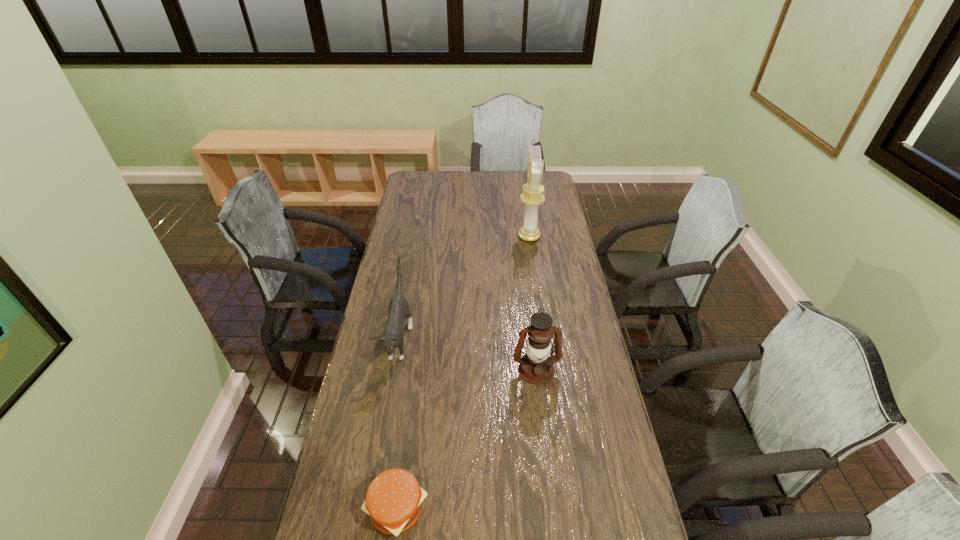
This screenshot has width=960, height=540. I want to click on the farthest object, so click(x=532, y=196).

Find the location of `award`. award is located at coordinates (532, 196).

The width and height of the screenshot is (960, 540). Identify the location of lantern. (536, 367).

At what (x,y) coordinates should I click in order to perform the action: click on cat. Please return your answer as a coordinate pair (x, y). The width and height of the screenshot is (960, 540). Looking at the image, I should click on (392, 338).

The height and width of the screenshot is (540, 960). What are the coordinates of `free spot located 0.110m on the front-facing side of the award` in the screenshot? It's located at (493, 237).

Where is `free space located 0.140m on the front-facing side of the award`? free space located 0.140m on the front-facing side of the award is located at coordinates (487, 237).

Locate an element on the screen. This screenshot has height=540, width=960. vacant position located on the front-facing side of the award is located at coordinates (446, 237).

You are a GUI agent. You are given a task and a screenshot of the screen. Output one action in this format:
    pyautogui.click(x=<x>, y=<y>)
    Task: Click on the vacant space located on the side of the second tallest object, there is a wick adjustment knob
    Image resolution: width=960 pixels, height=540 pixels.
    Given the screenshot: What is the action you would take?
    pyautogui.click(x=546, y=453)

This screenshot has width=960, height=540. Identify the location of free point located 0.180m at the face of the cat. (383, 431).

At what (x,y) coordinates should I click in order to perform the action: click on object that is at the left edge. Please return your answer as a coordinate pair (x, y). This screenshot has height=540, width=960. Looking at the image, I should click on coord(392,338).